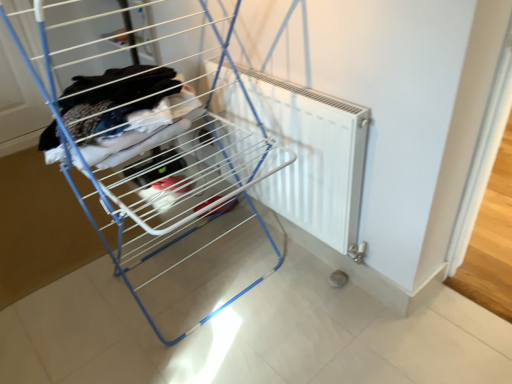
What are the coordinates of `free space that is to the left of white plastic radiator at center` in the screenshot? It's located at (57, 283).